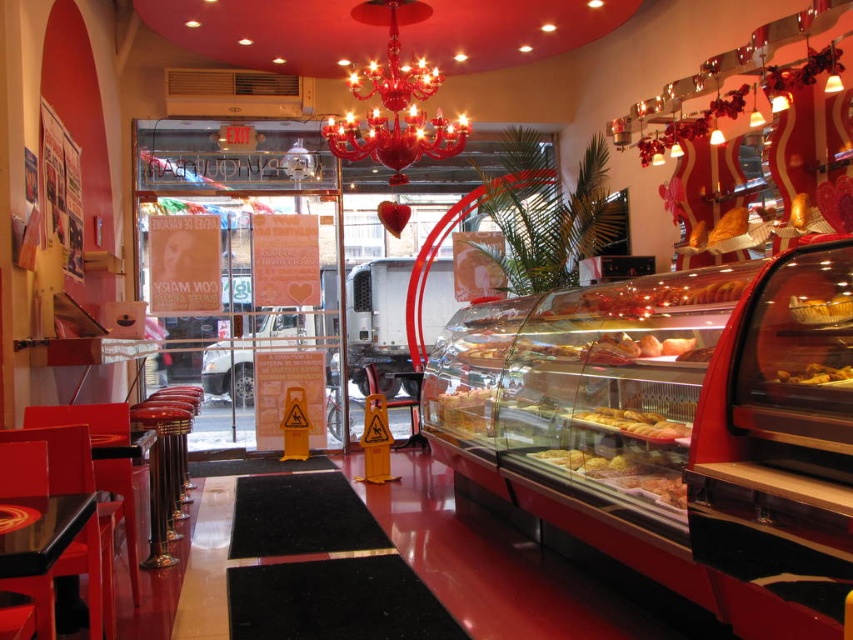
Between shiny glass chandelier at center and golden glazed pastry at center, which one is positioned lower?

golden glazed pastry at center is below.

From the picture: Between shiny glass chandelier at center and golden glazed pastry at center, which one has more height?

shiny glass chandelier at center is taller.

Who is more forward, [376,22] or [833,316]?

Point [833,316] is more forward.

The height and width of the screenshot is (640, 853). What are the coordinates of `shiny glass chandelier at center` in the screenshot? It's located at (393, 100).

Is shiny glass chandelier at center to the left of golden crispy pastry at center from the viewer's perspective?

Correct, you'll find shiny glass chandelier at center to the left of golden crispy pastry at center.

Describe the element at coordinates (393, 100) in the screenshot. I see `shiny glass chandelier at center` at that location.

Who is more forward, [421,4] or [830,380]?

Point [830,380] is in front.

The image size is (853, 640). Find the location of `shiny glass chandelier at center`. shiny glass chandelier at center is located at coordinates (393, 100).

Is point (625, 429) farther from camera compared to point (799, 378)?

That is True.

Does golden brown crusty bread at center appear over golden crispy pastry at center?

Incorrect, golden brown crusty bread at center is not positioned above golden crispy pastry at center.

Describe the element at coordinates (634, 422) in the screenshot. I see `golden brown crusty bread at center` at that location.

Find the location of `golden brown crusty bread at center`. golden brown crusty bread at center is located at coordinates (634, 422).